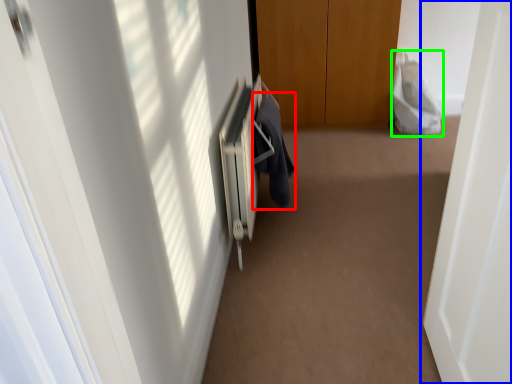
Question: Which object is the closest to the robe (highlighted by a red box)? Choose among these: door (highlighted by a blue box) or robe (highlighted by a green box).

Choices:
 (A) door
 (B) robe

Answer: (A)